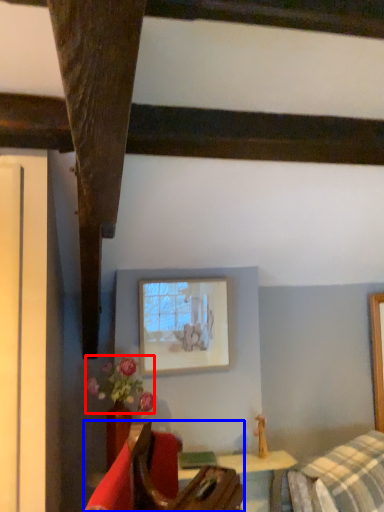
Question: Which of the following is the farthest to the observer, flower (highlighted by a red box) or furniture (highlighted by a blue box)?

Choices:
 (A) flower
 (B) furniture

Answer: (A)